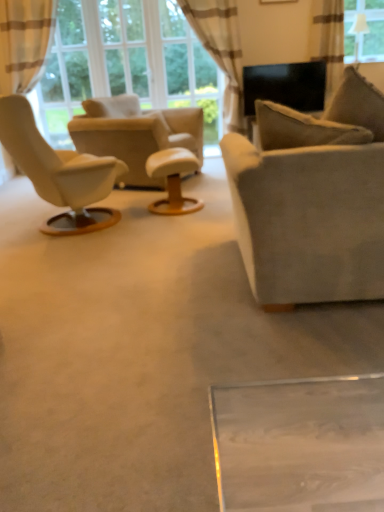
This screenshot has height=512, width=384. I want to click on vacant area that is in front of white leather ottoman at center, so click(x=170, y=224).